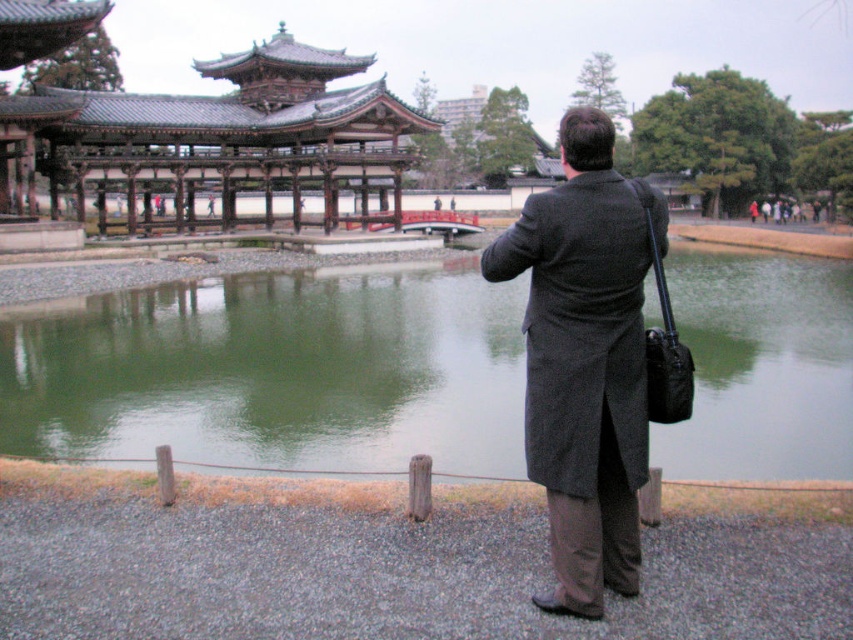
You are a tourist visiting the garden and want to take a photo of the green water at center and the dark gray wool coat at center. Which object is closer to the camera?

The dark gray wool coat at center is closer to the camera because it is taller than the green water at center, indicating it is positioned in front.